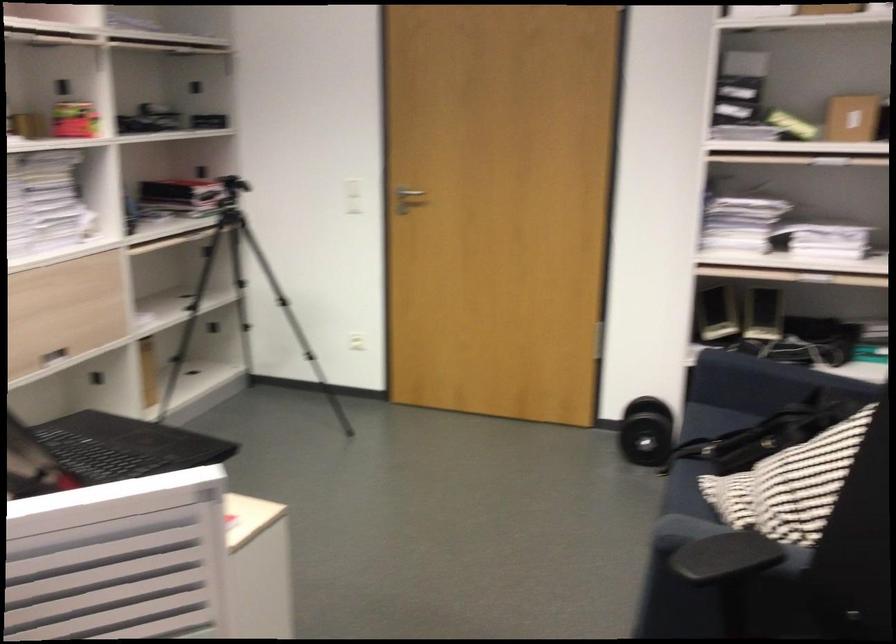
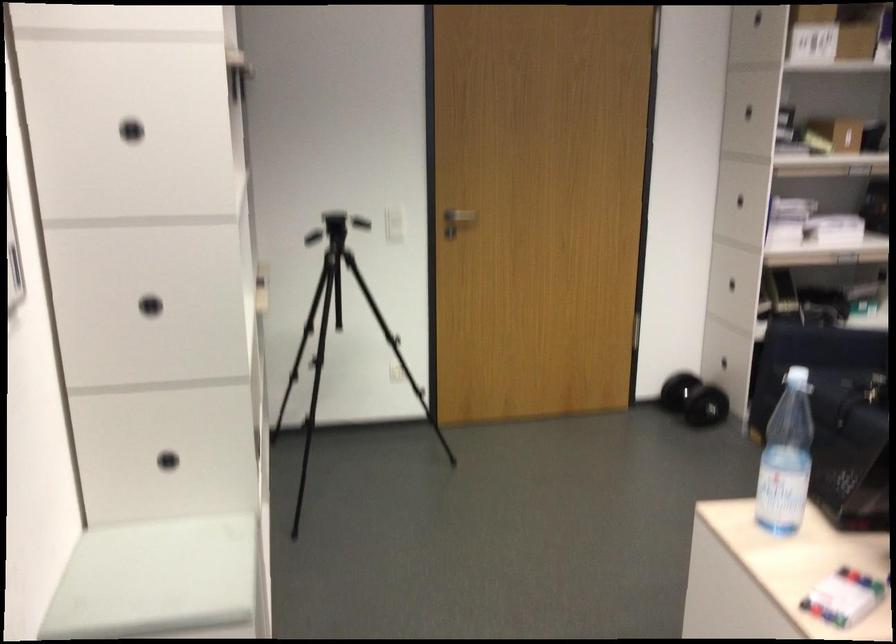
Question: Which direction would the cameraman need to move to produce the second image? Reply with the corresponding letter.

Choices:
 (A) Left
 (B) Right
 (C) Forward
 (D) Backward

Answer: (A)